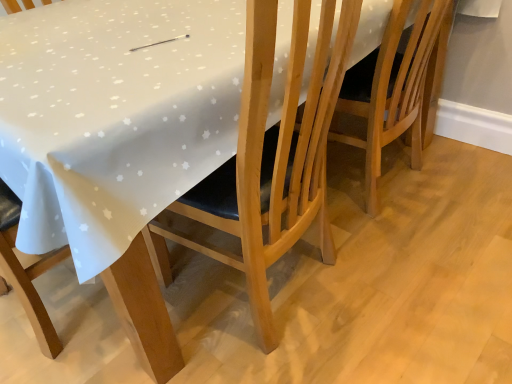
Where is `wooden chair at center, acting as the 1th chair starting from the left`? wooden chair at center, acting as the 1th chair starting from the left is located at coordinates (270, 158).

The image size is (512, 384). What do you see at coordinates (270, 158) in the screenshot?
I see `wooden chair at center, acting as the 1th chair starting from the left` at bounding box center [270, 158].

What is the approximate width of wooden chair at center, acting as the 1th chair starting from the left?

It is 24.42 inches.

Where is `light brown wooden chair at center, which ranks as the first chair in right-to-left order`? The image size is (512, 384). light brown wooden chair at center, which ranks as the first chair in right-to-left order is located at coordinates (402, 89).

How much space does light brown wooden chair at center, acting as the second chair starting from the left, occupy horizontally?

light brown wooden chair at center, acting as the second chair starting from the left, is 24.71 inches wide.

Measure the distance between point (400, 122) and camera.

The depth of point (400, 122) is 5.05 feet.

Describe the element at coordinates (402, 89) in the screenshot. I see `light brown wooden chair at center, which ranks as the first chair in right-to-left order` at that location.

Consider the image. What is the approximate height of light brown wooden chair at center, which ranks as the first chair in right-to-left order?

light brown wooden chair at center, which ranks as the first chair in right-to-left order, is 31.53 inches in height.

Find the location of a particular element. This screenshot has height=384, width=512. wooden chair at center, which ranks as the 2th chair in right-to-left order is located at coordinates (270, 158).

Visually, is wooden chair at center, acting as the 1th chair starting from the left, positioned to the left or to the right of light brown wooden chair at center, which ranks as the first chair in right-to-left order?

wooden chair at center, acting as the 1th chair starting from the left, is positioned on light brown wooden chair at center, which ranks as the first chair in right-to-left order,'s left side.

Relative to light brown wooden chair at center, acting as the second chair starting from the left, is wooden chair at center, which ranks as the 2th chair in right-to-left order, in front or behind?

Clearly, wooden chair at center, which ranks as the 2th chair in right-to-left order, is in front of light brown wooden chair at center, acting as the second chair starting from the left.

Consider the image. Which point is more distant from viewer, (314,210) or (400,28)?

The point (314,210) is behind.

From the image's perspective, which one is positioned lower, wooden chair at center, which ranks as the 2th chair in right-to-left order, or light brown wooden chair at center, acting as the second chair starting from the left?

wooden chair at center, which ranks as the 2th chair in right-to-left order, appears lower in the image.

From a real-world perspective, is wooden chair at center, acting as the 1th chair starting from the left, under light brown wooden chair at center, which ranks as the first chair in right-to-left order?

No, from a real-world perspective, wooden chair at center, acting as the 1th chair starting from the left, is not beneath light brown wooden chair at center, which ranks as the first chair in right-to-left order.

Considering the relative sizes of wooden chair at center, which ranks as the 2th chair in right-to-left order, and light brown wooden chair at center, acting as the second chair starting from the left, in the image provided, is wooden chair at center, which ranks as the 2th chair in right-to-left order, thinner than light brown wooden chair at center, acting as the second chair starting from the left,?

Yes, wooden chair at center, which ranks as the 2th chair in right-to-left order, is thinner than light brown wooden chair at center, acting as the second chair starting from the left.

Is wooden chair at center, which ranks as the 2th chair in right-to-left order, shorter than light brown wooden chair at center, acting as the second chair starting from the left?

In fact, wooden chair at center, which ranks as the 2th chair in right-to-left order, may be taller than light brown wooden chair at center, acting as the second chair starting from the left.

Considering the sizes of wooden chair at center, which ranks as the 2th chair in right-to-left order, and light brown wooden chair at center, acting as the second chair starting from the left, in the image, is wooden chair at center, which ranks as the 2th chair in right-to-left order, bigger or smaller than light brown wooden chair at center, acting as the second chair starting from the left,?

Clearly, wooden chair at center, which ranks as the 2th chair in right-to-left order, is larger in size than light brown wooden chair at center, acting as the second chair starting from the left.

Choose the correct answer: Is wooden chair at center, acting as the 1th chair starting from the left, inside light brown wooden chair at center, which ranks as the first chair in right-to-left order, or outside it?

wooden chair at center, acting as the 1th chair starting from the left, is spatially situated outside light brown wooden chair at center, which ranks as the first chair in right-to-left order.

Is wooden chair at center, which ranks as the 2th chair in right-to-left order, touching light brown wooden chair at center, acting as the second chair starting from the left?

No.

Could you tell me if wooden chair at center, which ranks as the 2th chair in right-to-left order, is turned towards light brown wooden chair at center, acting as the second chair starting from the left?

No.

How distant is wooden chair at center, acting as the 1th chair starting from the left, from light brown wooden chair at center, which ranks as the first chair in right-to-left order?

The distance of wooden chair at center, acting as the 1th chair starting from the left, from light brown wooden chair at center, which ranks as the first chair in right-to-left order, is 55.87 centimeters.

Where is `chair in front of the light brown wooden chair at center, acting as the second chair starting from the left`? This screenshot has width=512, height=384. chair in front of the light brown wooden chair at center, acting as the second chair starting from the left is located at coordinates (270, 158).

Can you confirm if light brown wooden chair at center, which ranks as the first chair in right-to-left order, is positioned to the right of wooden chair at center, acting as the 1th chair starting from the left?

Yes.

Is the position of light brown wooden chair at center, acting as the second chair starting from the left, less distant than that of wooden chair at center, which ranks as the 2th chair in right-to-left order?

No, light brown wooden chair at center, acting as the second chair starting from the left, is further to the viewer.

Is point (340, 100) farther from camera compared to point (282, 129)?

Yes, it is.

From the image's perspective, is light brown wooden chair at center, acting as the second chair starting from the left, beneath wooden chair at center, acting as the 1th chair starting from the left?

No, from the image's perspective, light brown wooden chair at center, acting as the second chair starting from the left, is not below wooden chair at center, acting as the 1th chair starting from the left.

From a real-world perspective, relative to wooden chair at center, acting as the 1th chair starting from the left, is light brown wooden chair at center, which ranks as the first chair in right-to-left order, vertically above or below?

From a real-world perspective, light brown wooden chair at center, which ranks as the first chair in right-to-left order, is physically below wooden chair at center, acting as the 1th chair starting from the left.

Between light brown wooden chair at center, which ranks as the first chair in right-to-left order, and wooden chair at center, which ranks as the 2th chair in right-to-left order, which one has smaller width?

Thinner between the two is wooden chair at center, which ranks as the 2th chair in right-to-left order.

Considering the relative sizes of light brown wooden chair at center, acting as the second chair starting from the left, and wooden chair at center, acting as the 1th chair starting from the left, in the image provided, is light brown wooden chair at center, acting as the second chair starting from the left, shorter than wooden chair at center, acting as the 1th chair starting from the left,?

Yes.

Which of these two, light brown wooden chair at center, acting as the second chair starting from the left, or wooden chair at center, which ranks as the 2th chair in right-to-left order, is bigger?

wooden chair at center, which ranks as the 2th chair in right-to-left order, is bigger.

Would you say light brown wooden chair at center, acting as the second chair starting from the left, is inside or outside wooden chair at center, acting as the 1th chair starting from the left?

light brown wooden chair at center, acting as the second chair starting from the left, is not inside wooden chair at center, acting as the 1th chair starting from the left, it's outside.

Is light brown wooden chair at center, which ranks as the first chair in right-to-left order, facing away from wooden chair at center, acting as the 1th chair starting from the left?

light brown wooden chair at center, which ranks as the first chair in right-to-left order, is not turned away from wooden chair at center, acting as the 1th chair starting from the left.

The width and height of the screenshot is (512, 384). I want to click on chair lying below the light brown wooden chair at center, acting as the second chair starting from the left (from the image's perspective), so click(270, 158).

This screenshot has height=384, width=512. I want to click on chair in front of the light brown wooden chair at center, which ranks as the first chair in right-to-left order, so click(x=270, y=158).

I want to click on chair located underneath the wooden chair at center, acting as the 1th chair starting from the left (from a real-world perspective), so click(402, 89).